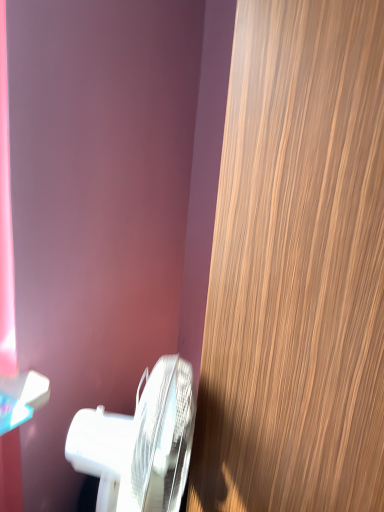
Question: From the image's perspective, does wooden door at right appear higher than white glossy toilet at lower left?

Choices:
 (A) no
 (B) yes

Answer: (B)

Question: From a real-world perspective, is wooden door at right beneath white glossy toilet at lower left?

Choices:
 (A) no
 (B) yes

Answer: (A)

Question: Is wooden door at right in front of white glossy toilet at lower left?

Choices:
 (A) yes
 (B) no

Answer: (A)

Question: Can you confirm if wooden door at right is shorter than white glossy toilet at lower left?

Choices:
 (A) no
 (B) yes

Answer: (A)

Question: Is wooden door at right not close to white glossy toilet at lower left?

Choices:
 (A) yes
 (B) no

Answer: (B)

Question: Is wooden door at right facing away from white glossy toilet at lower left?

Choices:
 (A) no
 (B) yes

Answer: (A)

Question: Is wooden door at right a part of white glossy toilet at lower left?

Choices:
 (A) no
 (B) yes

Answer: (A)

Question: Is white glossy toilet at lower left closer to the viewer compared to wooden door at right?

Choices:
 (A) no
 (B) yes

Answer: (A)

Question: Are white glossy toilet at lower left and wooden door at right far apart?

Choices:
 (A) no
 (B) yes

Answer: (A)

Question: Is the depth of white glossy toilet at lower left greater than that of wooden door at right?

Choices:
 (A) yes
 (B) no

Answer: (A)

Question: Is white glossy toilet at lower left at the right side of wooden door at right?

Choices:
 (A) yes
 (B) no

Answer: (B)

Question: Is white glossy toilet at lower left facing towards wooden door at right?

Choices:
 (A) no
 (B) yes

Answer: (B)

Question: Considering the positions of wooden door at right and white glossy toilet at lower left in the image, is wooden door at right wider or thinner than white glossy toilet at lower left?

Choices:
 (A) thin
 (B) wide

Answer: (B)